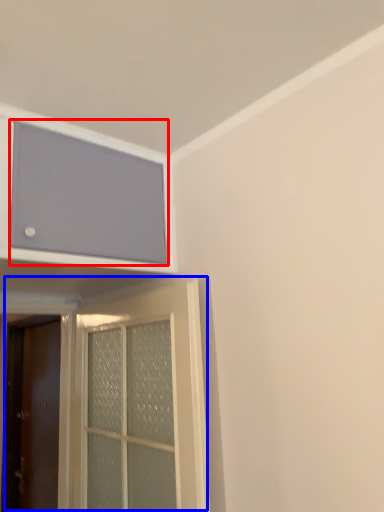
Question: Which object appears farthest to the camera in this image, window screen (highlighted by a red box) or door (highlighted by a blue box)?

Choices:
 (A) window screen
 (B) door

Answer: (B)